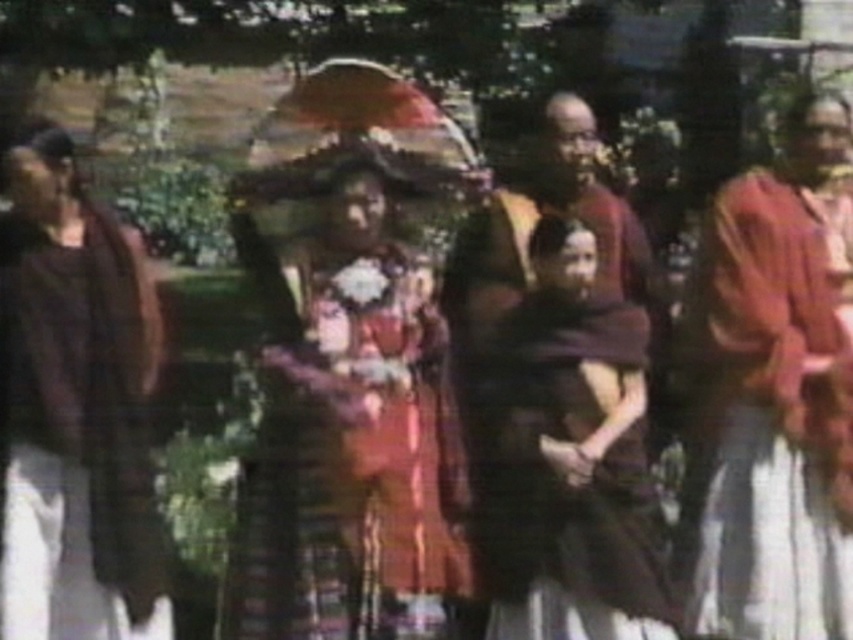
Question: Which of these objects is positioned farthest from the matte brown dress at left?

Choices:
 (A) textured fabric dress at center
 (B) silky pink dress at right

Answer: (B)

Question: Can you confirm if dark brown fabric shawl at center is thinner than matte brown dress at left?

Choices:
 (A) no
 (B) yes

Answer: (A)

Question: Is silky pink dress at right bigger than matte brown dress at left?

Choices:
 (A) no
 (B) yes

Answer: (A)

Question: Which of the following is the farthest from the observer?

Choices:
 (A) (38, 609)
 (B) (624, 561)

Answer: (A)

Question: Which of the following is the farthest from the observer?

Choices:
 (A) (299, 349)
 (B) (9, 616)

Answer: (A)

Question: Is textured fabric dress at center behind dark brown fabric shawl at center?

Choices:
 (A) yes
 (B) no

Answer: (A)